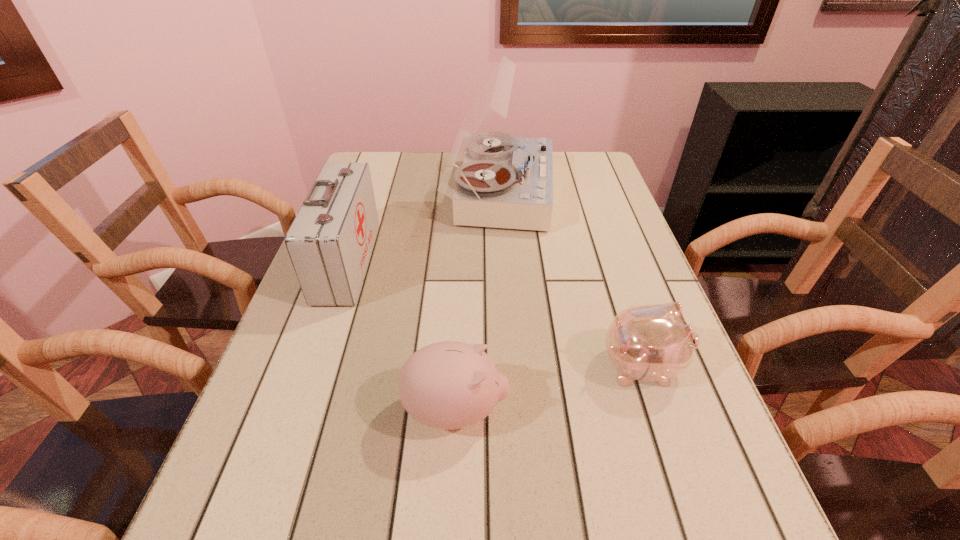
Locate an element on the screen. The width and height of the screenshot is (960, 540). vacant area at the far edge of the desktop is located at coordinates (459, 165).

In the image, there is a desktop. At what (x,y) coordinates should I click in order to perform the action: click on vacant space at the left edge. Please return your answer as a coordinate pair (x, y). Image resolution: width=960 pixels, height=540 pixels. Looking at the image, I should click on (278, 346).

Where is `vacant space at the right edge`? vacant space at the right edge is located at coordinates (644, 259).

Identify the location of vacant space at the far left corner of the desktop. (373, 189).

You are a GUI agent. You are given a task and a screenshot of the screen. Output one action in this format:
    pyautogui.click(x=<x>, y=<y>)
    Task: Click on the empty space that is in between the record player and the rightmost object
    Image resolution: width=960 pixels, height=540 pixels.
    Given the screenshot: What is the action you would take?
    pyautogui.click(x=571, y=279)

Locate an element on the screen. Image resolution: width=960 pixels, height=540 pixels. free point between the tallest object and the rightmost object is located at coordinates (571, 279).

Locate an element on the screen. The image size is (960, 540). vacant area that lies between the left piggy bank and the record player is located at coordinates (478, 301).

Locate an element on the screen. vacant region between the left piggy bank and the leftmost object is located at coordinates (401, 336).

Where is `free space between the record player and the right piggy bank`? The height and width of the screenshot is (540, 960). free space between the record player and the right piggy bank is located at coordinates (571, 279).

Where is `free space between the record player and the rightmost object`? The image size is (960, 540). free space between the record player and the rightmost object is located at coordinates (571, 279).